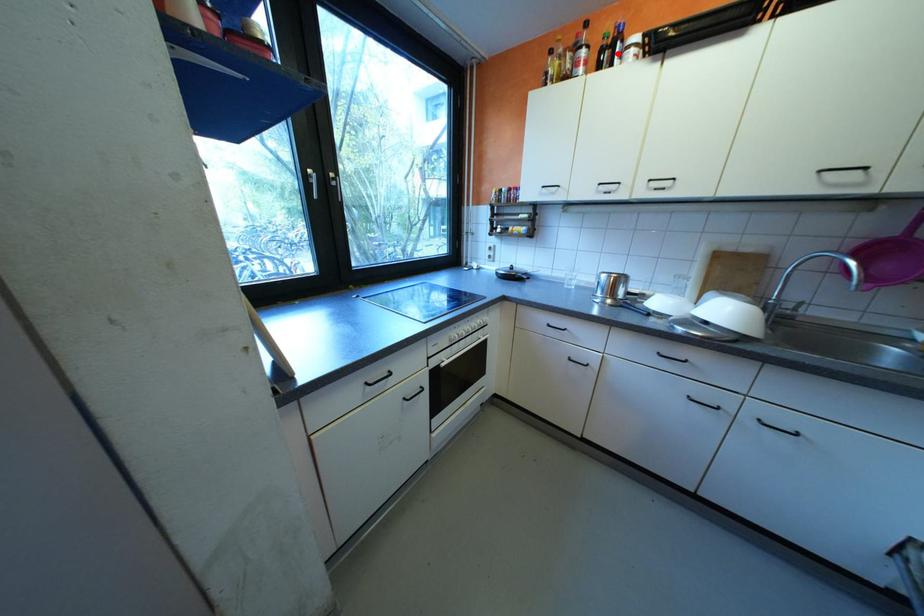
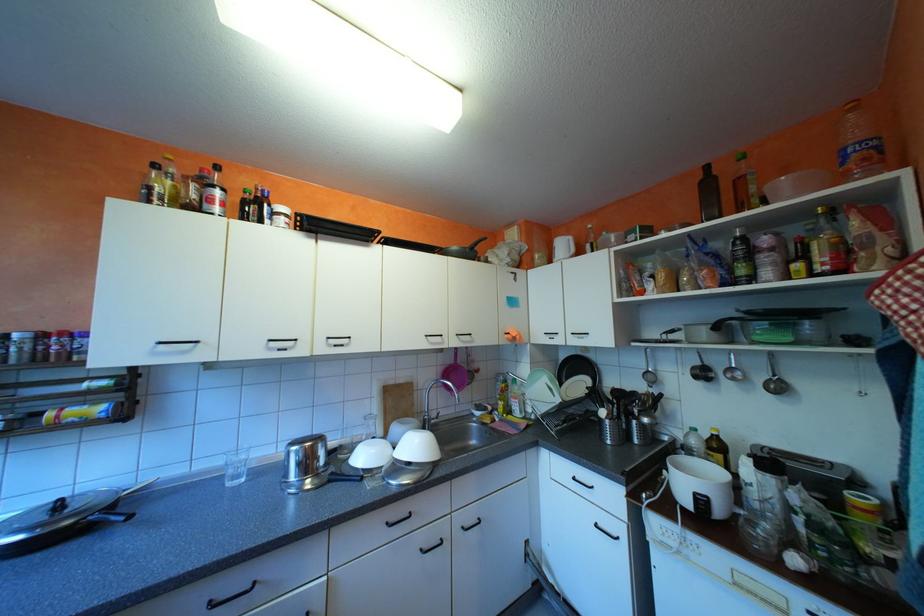
Find the pixel in the second image that matches the highlighted location in the first image.

(263, 208)